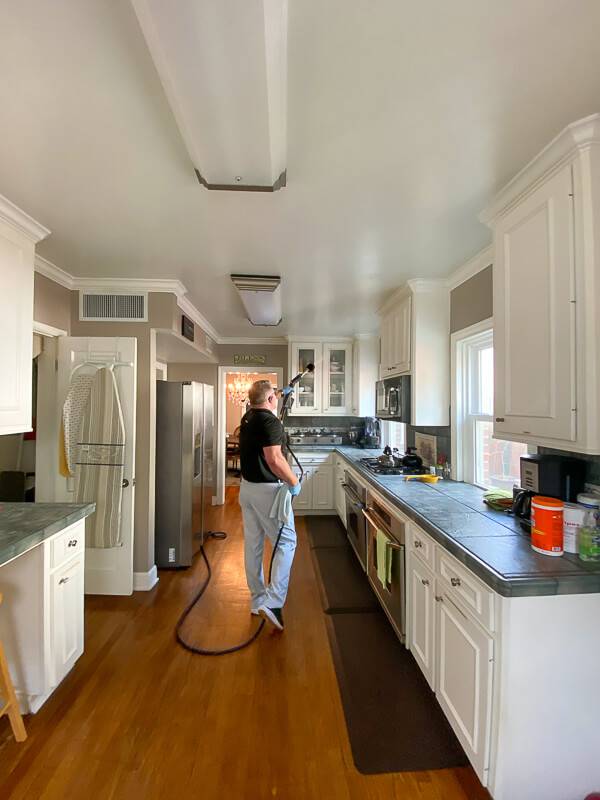
Image resolution: width=600 pixels, height=800 pixels. What are the coordinates of `oven door` in the screenshot? It's located at (359, 526), (395, 598).